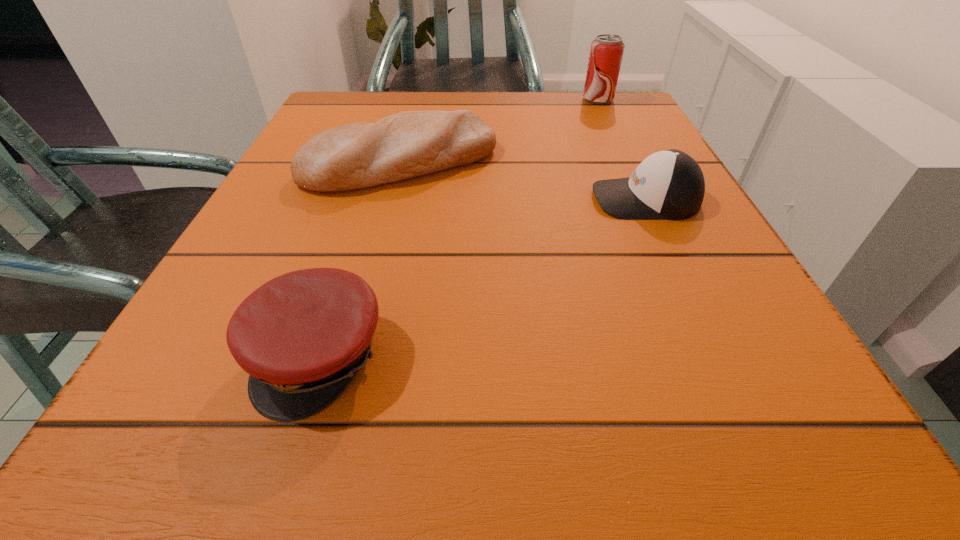
Locate an element on the screen. Image resolution: width=960 pixels, height=540 pixels. free point located 0.080m on the front panel of the farther cap is located at coordinates (544, 199).

The width and height of the screenshot is (960, 540). What are the coordinates of `vacant space located on the front of the left cap with an emblem` in the screenshot? It's located at (282, 472).

This screenshot has width=960, height=540. Find the location of `soda can present at the far edge`. soda can present at the far edge is located at coordinates (606, 52).

Where is `bread positioned at the far edge`? The width and height of the screenshot is (960, 540). bread positioned at the far edge is located at coordinates (410, 144).

The height and width of the screenshot is (540, 960). I want to click on object present at the near edge, so click(302, 337).

The image size is (960, 540). Identify the location of bread that is at the left edge. (410, 144).

Where is `cap that is positioned at the left edge`? cap that is positioned at the left edge is located at coordinates click(302, 337).

Locate an element on the screen. soda can that is positioned at the right edge is located at coordinates (606, 52).

This screenshot has width=960, height=540. Find the location of `cap situated at the right edge`. cap situated at the right edge is located at coordinates (669, 184).

Locate an element on the screen. This screenshot has width=960, height=540. object located in the far left corner section of the desktop is located at coordinates (410, 144).